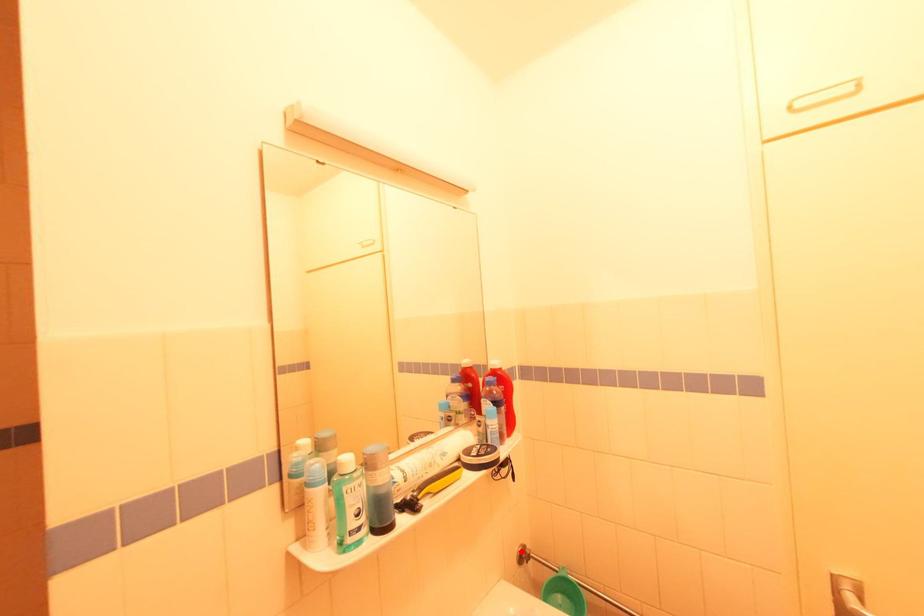
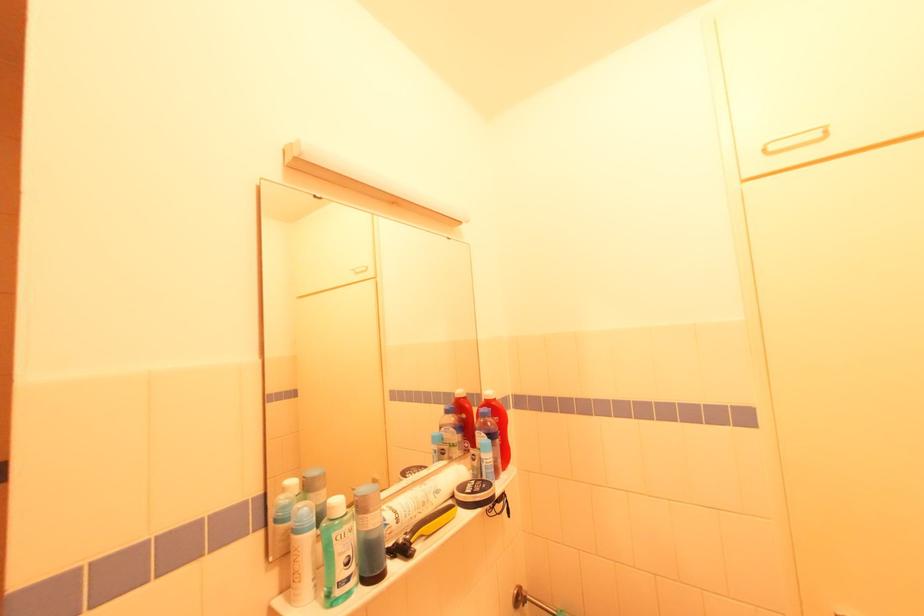
In the second image, find the point that corresponds to the highlighted location in the first image.

(517, 594)